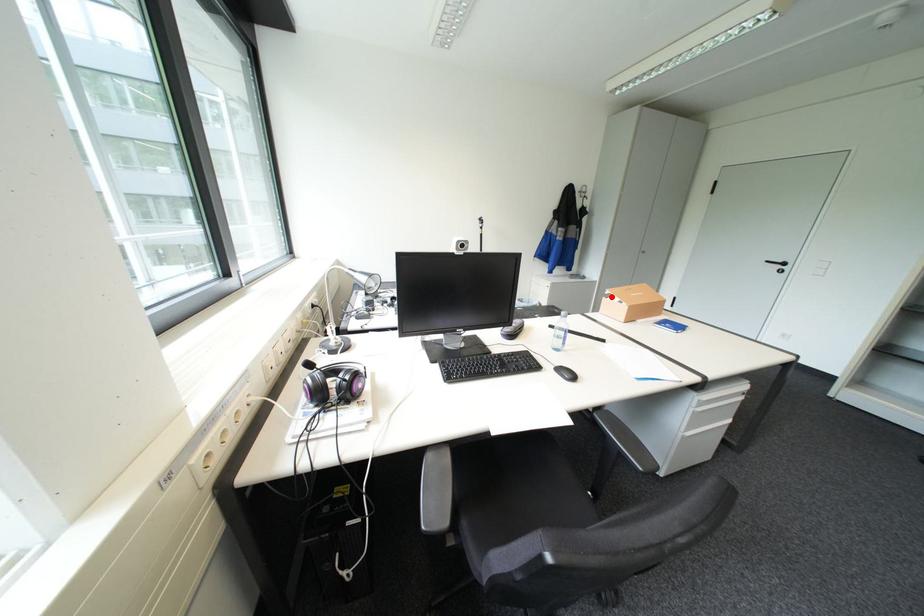
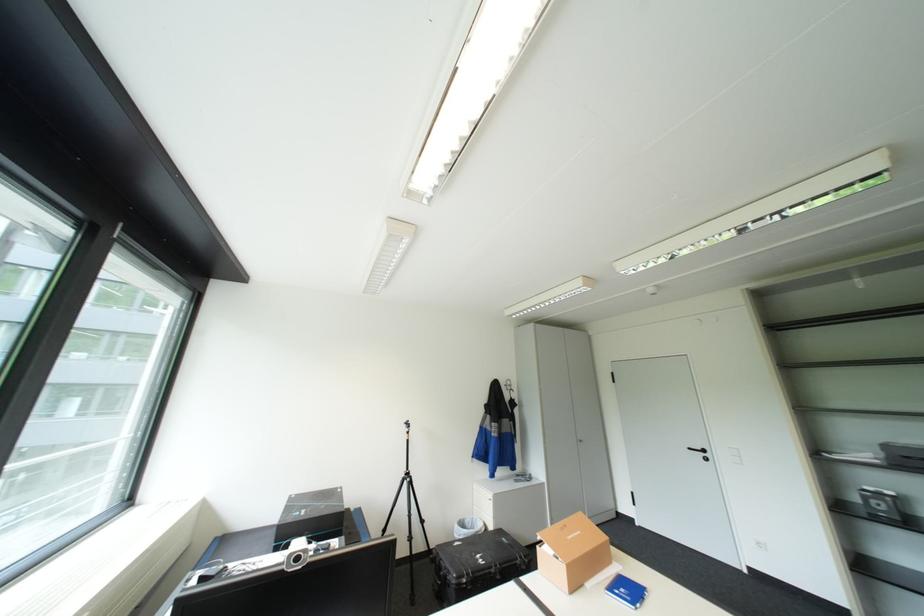
Question: I am providing you with two images of the same scene from different viewpoints. Image1 has a red point marked. In image2, the corresponding 3D location appears at what relative position? Reply with the corresponding letter.

Choices:
 (A) Closer
 (B) Farther

Answer: (B)